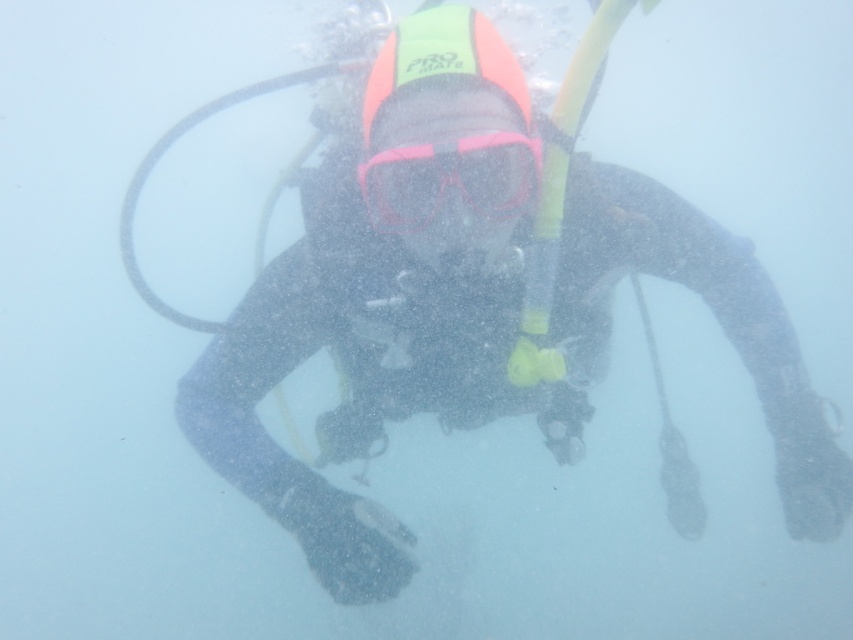
You are a scuba diver navigating through murky water. You see two points in the distance, point A at coordinates point A is point (404, 280) and point B at coordinates point B is point (401, 180). Which point is closer to you?

Point B at coordinates point B is point (401, 180) is closer to you because point A at coordinates point A is point (404, 280) is behind point B.